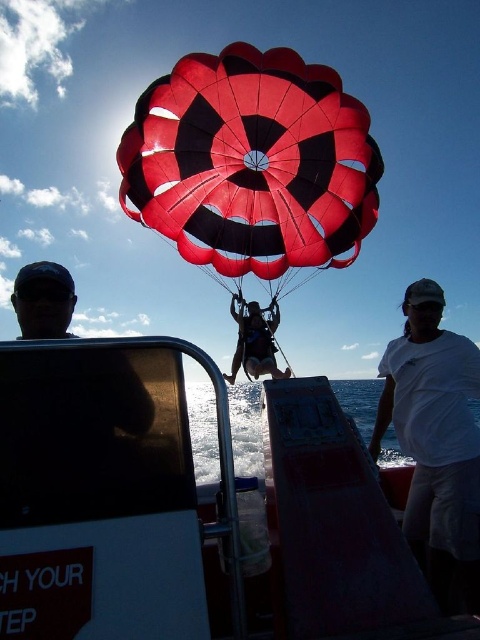
Question: Which of these objects is positioned farthest from the white plastic boat at center?

Choices:
 (A) red/black checkered parachute at center
 (B) clear blue water at center

Answer: (B)

Question: Is white cotton shirt at center smaller than clear blue water at center?

Choices:
 (A) yes
 (B) no

Answer: (A)

Question: Does white plastic boat at center appear on the left side of red/black checkered parachute at center?

Choices:
 (A) yes
 (B) no

Answer: (A)

Question: Which of the following is the farthest from the observer?

Choices:
 (A) white plastic boat at center
 (B) white cotton shirt at center
 (C) red/black checkered parachute at center
 (D) matte black wetsuit at center

Answer: (D)

Question: Which point appears farthest from the camera in this image?

Choices:
 (A) (14, 371)
 (B) (383, 451)
 (C) (455, 552)

Answer: (B)

Question: Can you confirm if clear blue water at center is wider than matte black wetsuit at center?

Choices:
 (A) yes
 (B) no

Answer: (A)